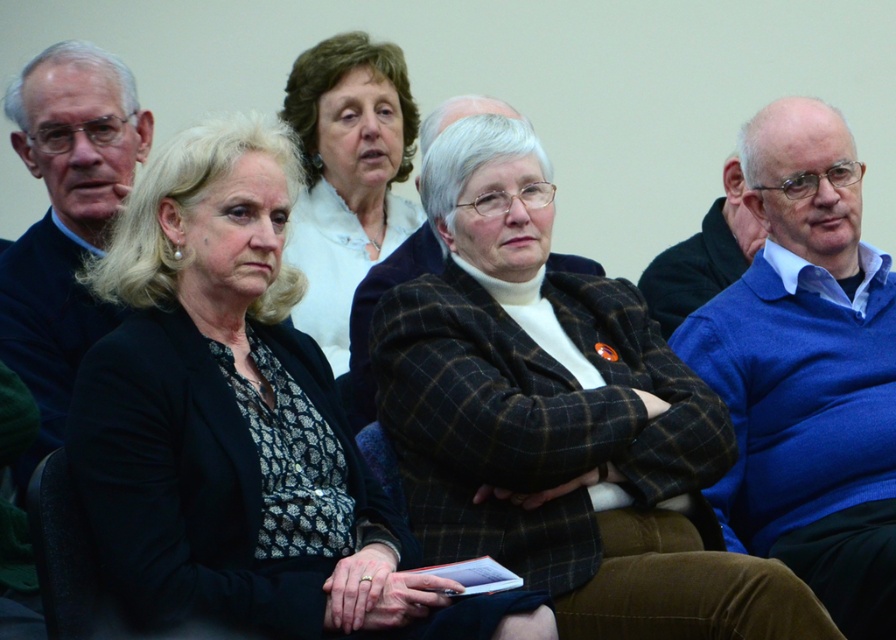
In the scene shown: You are standing in the conference room and want to determine which of the two points, point (116, 380) or point (407, 202), is nearer to you. Based on the image, which point is closer?

Point (116, 380) is closer to the camera than point (407, 202), so it is the nearer point.

You are a photographer setting up for a group photo in the conference room. You need to ensure that the black textured blazer at center and the white woolen sweater at upper center are at least 1 meter apart for composition. Based on the scene, can you confirm if they meet this requirement?

The black textured blazer at center and white woolen sweater at upper center are 1.02 meters apart from each other, which meets the requirement of being at least 1 meter apart for composition.